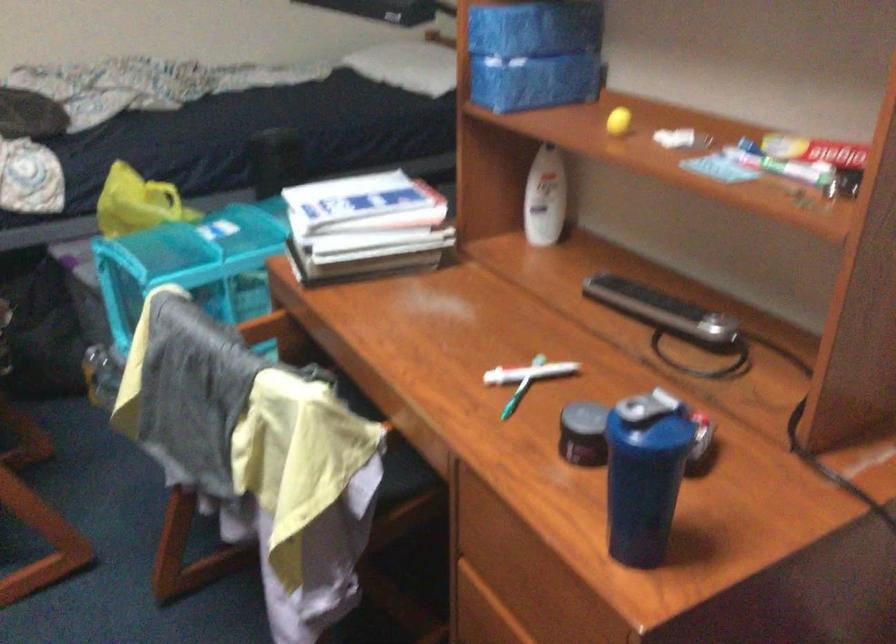
Describe the element at coordinates (644, 474) in the screenshot. The image size is (896, 644). I see `the blue shaker cup` at that location.